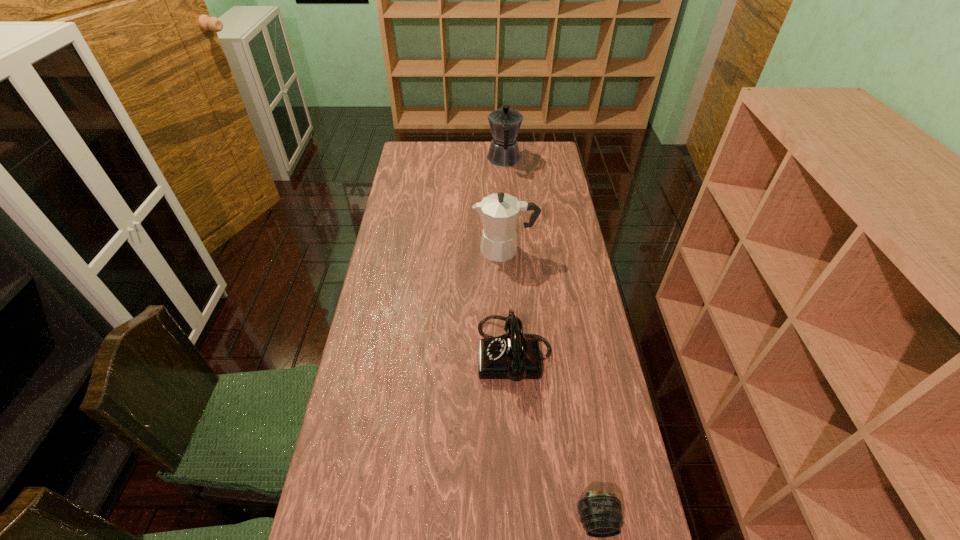
Identify the location of the farthest object. The height and width of the screenshot is (540, 960). (505, 123).

Locate an element on the screen. This screenshot has width=960, height=540. the nearer coffeepot is located at coordinates (499, 212).

Where is `telephone`? The width and height of the screenshot is (960, 540). telephone is located at coordinates (513, 356).

Identify the location of the third tallest object. (513, 356).

Locate an element on the screen. The width and height of the screenshot is (960, 540). telephoto lens is located at coordinates (600, 512).

This screenshot has height=540, width=960. Identify the location of the rightmost object. (600, 512).

Where is `free space located 0.110m at the spout of the nearer coffeepot`? This screenshot has height=540, width=960. free space located 0.110m at the spout of the nearer coffeepot is located at coordinates (444, 249).

This screenshot has height=540, width=960. In order to click on vacant space located 0.170m at the spout of the nearer coffeepot in this screenshot , I will do `click(428, 249)`.

The image size is (960, 540). Find the location of `vacant space located 0.100m at the spout of the nearer coffeepot`. vacant space located 0.100m at the spout of the nearer coffeepot is located at coordinates pyautogui.click(x=446, y=249).

Where is `vacant space located on the dial of the second shortest object`? vacant space located on the dial of the second shortest object is located at coordinates (392, 354).